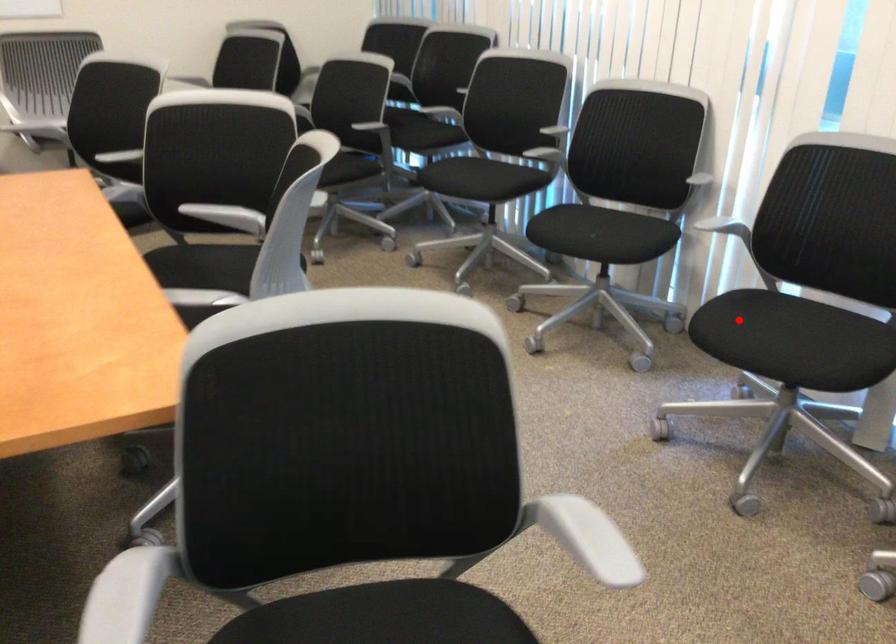
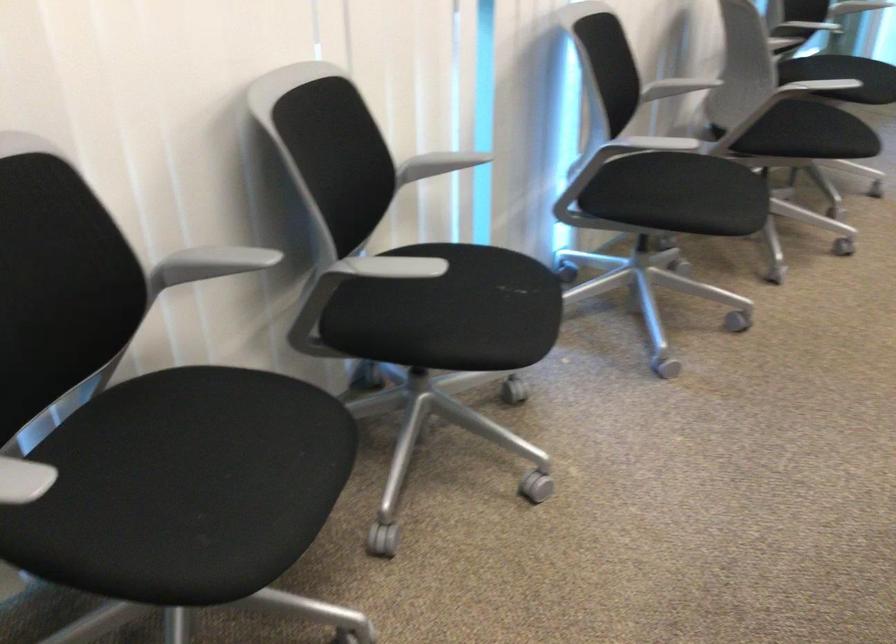
Where in the second image is the point corresponding to the highlighted location from the first image?

(679, 194)